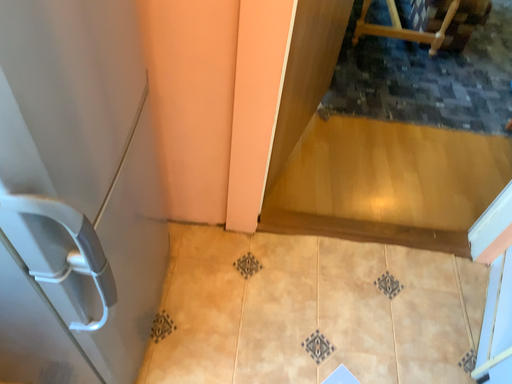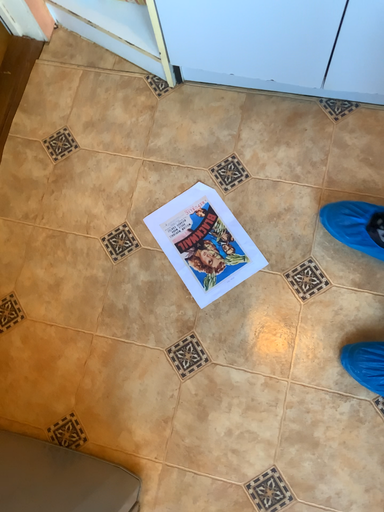
Question: Which way did the camera rotate in the video?

Choices:
 (A) rotated left
 (B) rotated right

Answer: (B)